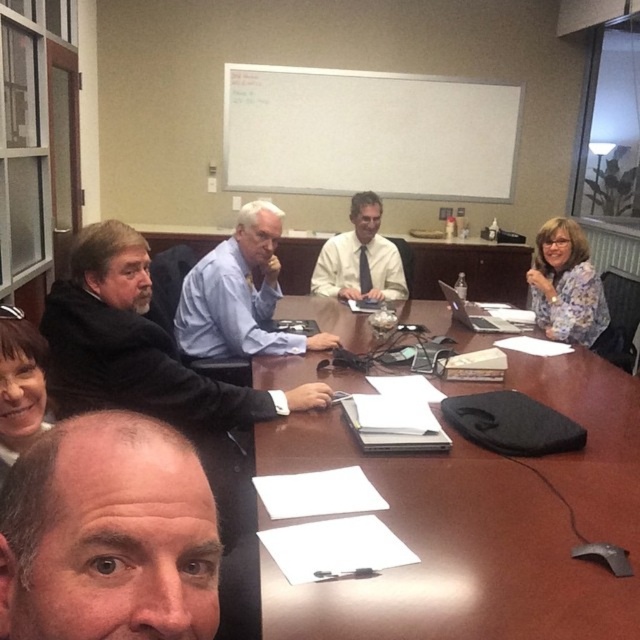
Question: Which point appears closest to the camera in this image?

Choices:
 (A) (548, 280)
 (B) (161, 525)
 (C) (106, 348)
 (D) (516, 326)

Answer: (B)

Question: Does floral fabric blouse at upper right have a greater width compared to smooth brown hair at lower left?

Choices:
 (A) yes
 (B) no

Answer: (A)

Question: Which object appears farthest from the camera in this image?

Choices:
 (A) blue shirt at center
 (B) brown wooden table at center
 (C) smooth brown hair at lower left
 (D) matte black laptop at center

Answer: (D)

Question: Which object is farther from the camera taking this photo?

Choices:
 (A) brown wooden table at center
 (B) matte black laptop at center
 (C) white shirt at center

Answer: (C)

Question: Is brown wooden table at center positioned behind smooth skin face at lower left?

Choices:
 (A) no
 (B) yes

Answer: (B)

Question: Can you confirm if smooth skin face at lower left is positioned to the right of floral fabric blouse at upper right?

Choices:
 (A) yes
 (B) no

Answer: (B)